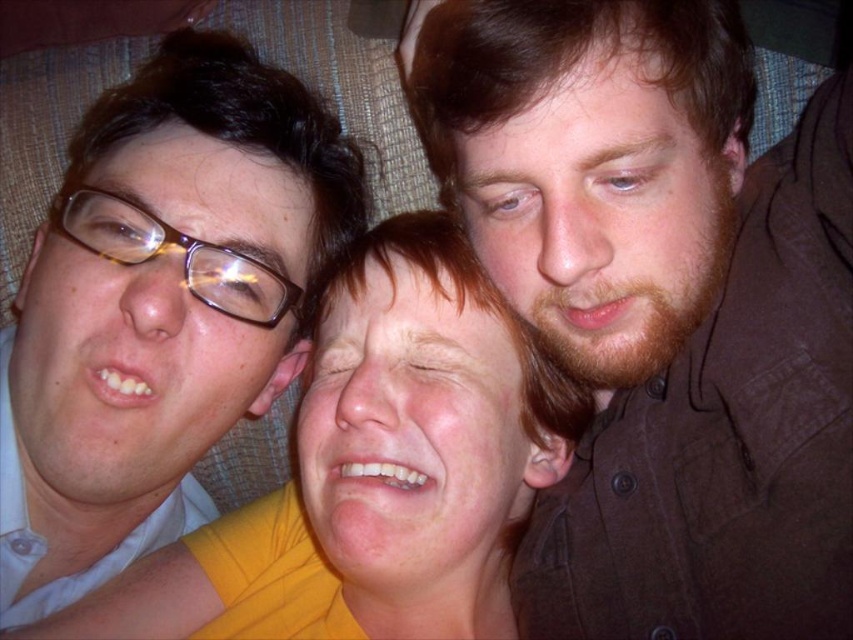
Does matte black glasses at left have a greater height compared to yellow matte shirt at center?

Indeed, matte black glasses at left has a greater height compared to yellow matte shirt at center.

Does matte black glasses at left appear on the left side of yellow matte shirt at center?

Indeed, matte black glasses at left is positioned on the left side of yellow matte shirt at center.

I want to click on matte black glasses at left, so click(x=160, y=307).

Where is `matte black glasses at left`? The image size is (853, 640). matte black glasses at left is located at coordinates (160, 307).

Which of these two, brown matte shirt at upper right or yellow matte shirt at center, stands shorter?

Standing shorter between the two is yellow matte shirt at center.

Is point (692, 385) in front of point (183, 548)?

That is True.

At what (x,y) coordinates should I click in order to perform the action: click on brown matte shirt at upper right. Please return your answer as a coordinate pair (x, y). Looking at the image, I should click on (660, 305).

Can you confirm if brown matte shirt at upper right is thinner than matte black glasses at left?

Indeed, brown matte shirt at upper right has a lesser width compared to matte black glasses at left.

Who is positioned more to the right, brown matte shirt at upper right or matte black glasses at left?

brown matte shirt at upper right is more to the right.

This screenshot has height=640, width=853. In order to click on brown matte shirt at upper right in this screenshot , I will do `click(660, 305)`.